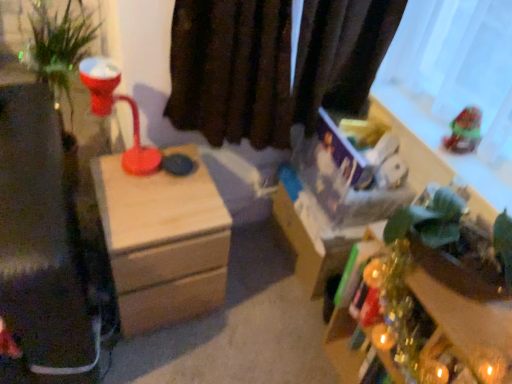
Question: Is the surface of green matte plant at lower right in direct contact with wooden nightstand at center?

Choices:
 (A) no
 (B) yes

Answer: (A)

Question: Is green matte plant at lower right oriented away from wooden nightstand at center?

Choices:
 (A) yes
 (B) no

Answer: (B)

Question: Can you confirm if green matte plant at lower right is thinner than wooden nightstand at center?

Choices:
 (A) yes
 (B) no

Answer: (A)

Question: Can you confirm if green matte plant at lower right is wider than wooden nightstand at center?

Choices:
 (A) yes
 (B) no

Answer: (B)

Question: Is green matte plant at lower right shorter than wooden nightstand at center?

Choices:
 (A) no
 (B) yes

Answer: (B)

Question: From the image's perspective, would you say green matte plant at lower right is shown under wooden nightstand at center?

Choices:
 (A) yes
 (B) no

Answer: (A)

Question: Is shiny plastic toy at upper right at the right side of green matte plant at lower right?

Choices:
 (A) yes
 (B) no

Answer: (A)

Question: Is the depth of shiny plastic toy at upper right less than that of green matte plant at lower right?

Choices:
 (A) no
 (B) yes

Answer: (A)

Question: Is shiny plastic toy at upper right not close to green matte plant at lower right?

Choices:
 (A) no
 (B) yes

Answer: (A)

Question: Considering the relative sizes of shiny plastic toy at upper right and green matte plant at lower right in the image provided, is shiny plastic toy at upper right smaller than green matte plant at lower right?

Choices:
 (A) yes
 (B) no

Answer: (A)

Question: Considering the relative sizes of shiny plastic toy at upper right and green matte plant at lower right in the image provided, is shiny plastic toy at upper right wider than green matte plant at lower right?

Choices:
 (A) no
 (B) yes

Answer: (A)

Question: Can you confirm if shiny plastic toy at upper right is taller than green matte plant at lower right?

Choices:
 (A) no
 (B) yes

Answer: (A)

Question: Is wooden nightstand at center at the right side of green matte plant at lower right?

Choices:
 (A) yes
 (B) no

Answer: (B)